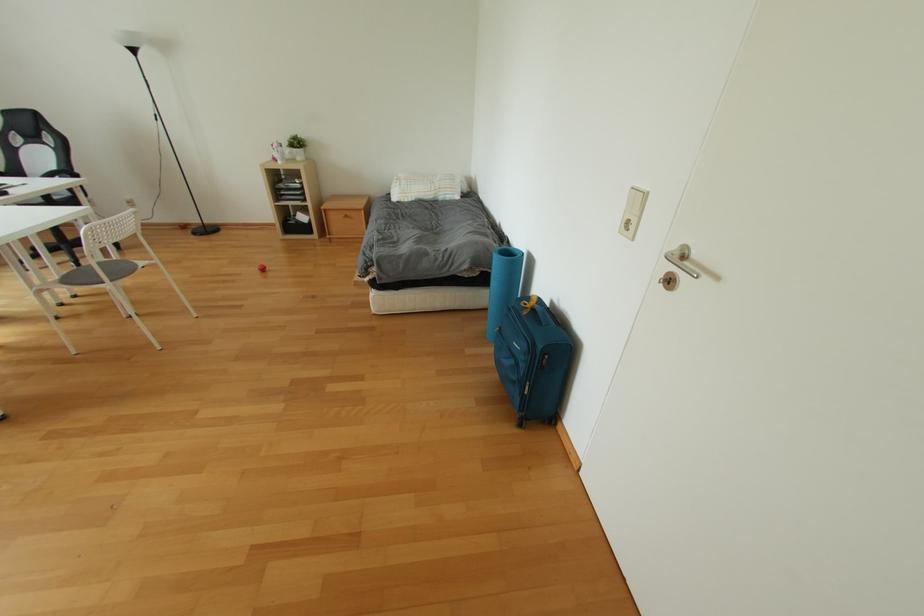
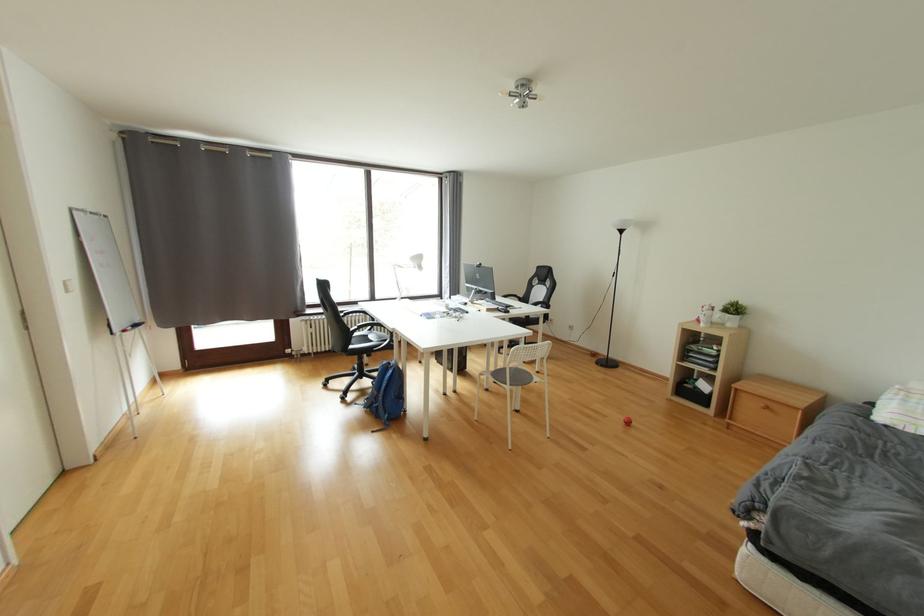
Question: The first image is from the beginning of the video and the second image is from the end. How did the camera likely rotate when shooting the video?

Choices:
 (A) Left
 (B) Right
 (C) Up
 (D) Down

Answer: (A)